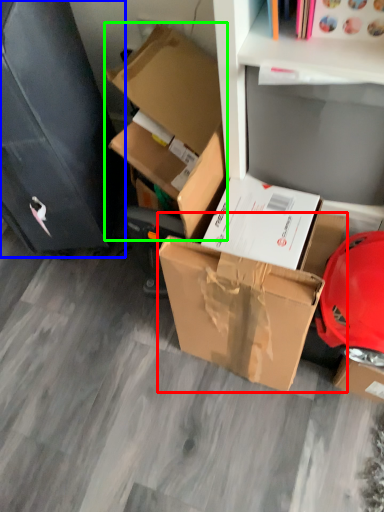
Question: Based on their relative distances, which object is nearer to box (highlighted by a red box)? Choose from file cabinet (highlighted by a blue box) and box (highlighted by a green box).

Choices:
 (A) file cabinet
 (B) box

Answer: (B)